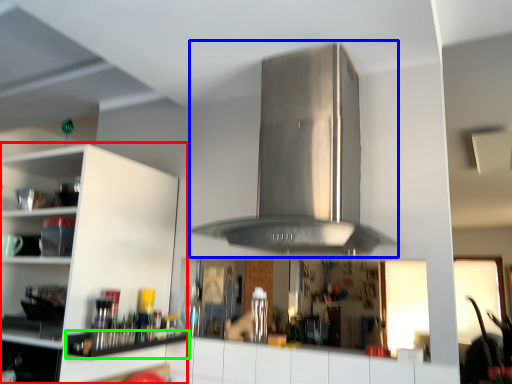
Question: Which object is positioned farthest from cabinetry (highlighted by a red box)? Select from vent (highlighted by a blue box) and shelf (highlighted by a green box).

Choices:
 (A) vent
 (B) shelf

Answer: (A)